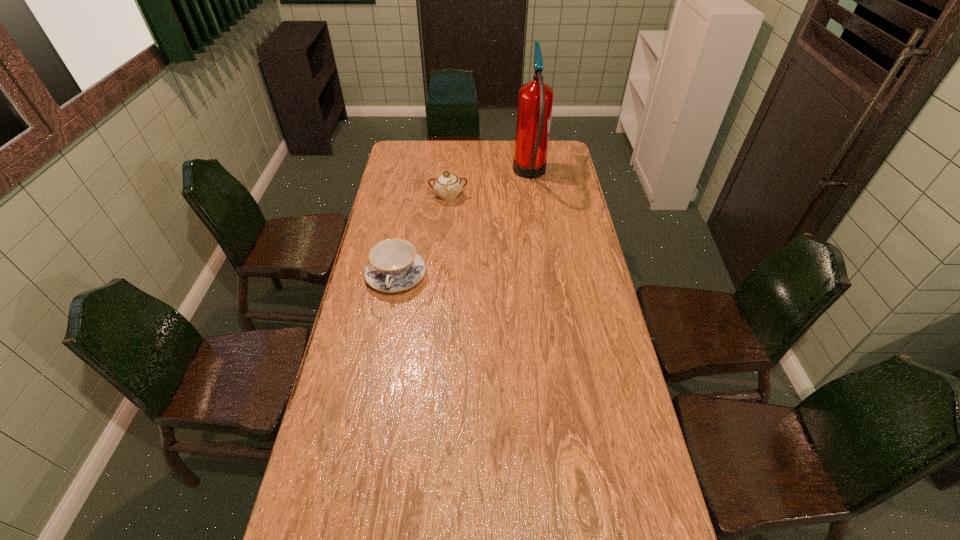
At what (x,y) coordinates should I click in order to perform the action: click on object that is positioned at the left edge. Please return your answer as a coordinate pair (x, y). This screenshot has width=960, height=540. Looking at the image, I should click on pos(393,266).

Locate an element on the screen. object that is positioned at the right edge is located at coordinates (535, 99).

Identify the location of object located in the far right corner section of the desktop. (535, 99).

Identify the location of free space at the far edge of the desktop. This screenshot has height=540, width=960. (498, 164).

Locate an element on the screen. The image size is (960, 540). vacant area at the left edge is located at coordinates (343, 442).

Identify the location of vacant space at the right edge of the desktop. The height and width of the screenshot is (540, 960). (606, 312).

Locate an element on the screen. The height and width of the screenshot is (540, 960). blank region between the second tallest object and the fire extinguisher is located at coordinates (490, 186).

In order to click on empty location between the taller chinaware and the nearer chinaware in this screenshot , I will do `click(422, 236)`.

You are a GUI agent. You are given a task and a screenshot of the screen. Output one action in this format:
    pyautogui.click(x=<x>, y=<y>)
    Task: Click on the free space between the fire extinguisher and the taller chinaware
    The width and height of the screenshot is (960, 540).
    Given the screenshot: What is the action you would take?
    pyautogui.click(x=490, y=186)

At what (x,y) coordinates should I click in order to perform the action: click on empty space that is in between the rightmost object and the nearest object. Please return your answer as a coordinate pair (x, y). The width and height of the screenshot is (960, 540). Looking at the image, I should click on (464, 226).